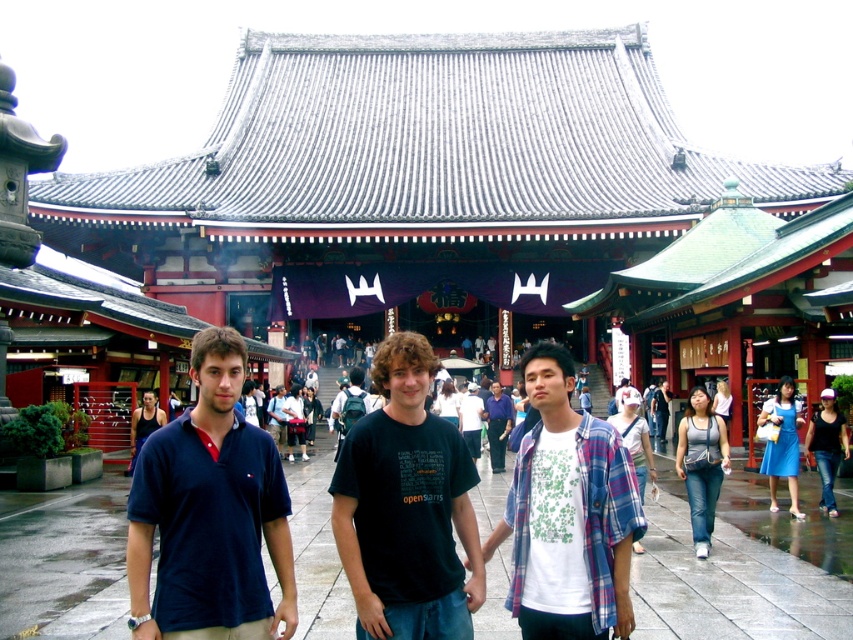
Question: Among these points, which one is nearest to the camera?

Choices:
 (A) (99, 636)
 (B) (577, 593)
 (C) (178, 621)
 (D) (498, 461)

Answer: (C)

Question: Which of the following is the farthest from the observer?

Choices:
 (A) black cotton t-shirt at center
 (B) gray concrete pavement at center
 (C) white cotton shirt at center
 (D) dark blue polo shirt at left

Answer: (B)

Question: Can you confirm if gray concrete pavement at center is wider than white cotton shirt at center?

Choices:
 (A) no
 (B) yes

Answer: (B)

Question: Can you confirm if dark blue polo shirt at left is wider than black cotton t-shirt at center?

Choices:
 (A) no
 (B) yes

Answer: (B)

Question: Which point is closer to the camera?

Choices:
 (A) (502, 448)
 (B) (664, 632)

Answer: (B)

Question: Is gray concrete pavement at center to the left of white cotton shirt at center from the viewer's perspective?

Choices:
 (A) no
 (B) yes

Answer: (B)